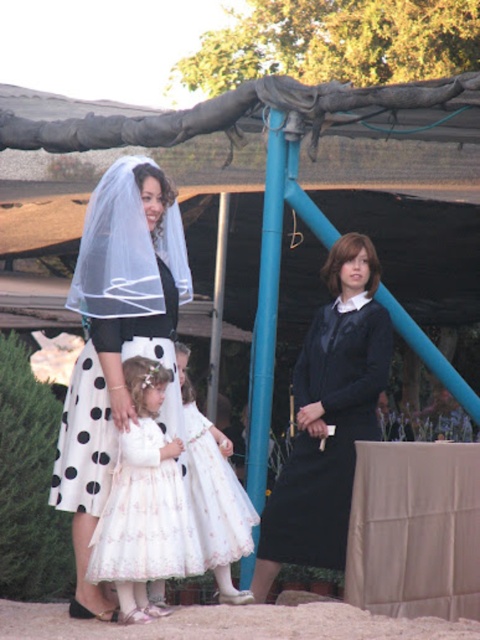
Which is more to the left, white sheer veil at upper left or white satin dress at center?

Positioned to the left is white sheer veil at upper left.

The width and height of the screenshot is (480, 640). What do you see at coordinates (117, 342) in the screenshot?
I see `white sheer veil at upper left` at bounding box center [117, 342].

The height and width of the screenshot is (640, 480). What do you see at coordinates (117, 342) in the screenshot? I see `white sheer veil at upper left` at bounding box center [117, 342].

Identify the location of white sheer veil at upper left. [x=117, y=342].

Is the position of matte black dress at center less distant than that of white satin dress at center?

That is False.

Describe the element at coordinates (328, 417) in the screenshot. The width and height of the screenshot is (480, 640). I see `matte black dress at center` at that location.

Which is behind, point (375, 372) or point (153, 362)?

The point (375, 372) is more distant.

This screenshot has height=640, width=480. What are the coordinates of `matte black dress at center` in the screenshot? It's located at (328, 417).

Who is more distant from viewer, (121, 356) or (187, 394)?

The point (187, 394) is behind.

Is white sheer veil at upper left further to the viewer compared to white lace dress at center?

No.

Where is `white sheer veil at upper left`? The width and height of the screenshot is (480, 640). white sheer veil at upper left is located at coordinates (117, 342).

Locate an element on the screen. Image resolution: width=480 pixels, height=640 pixels. white sheer veil at upper left is located at coordinates (117, 342).